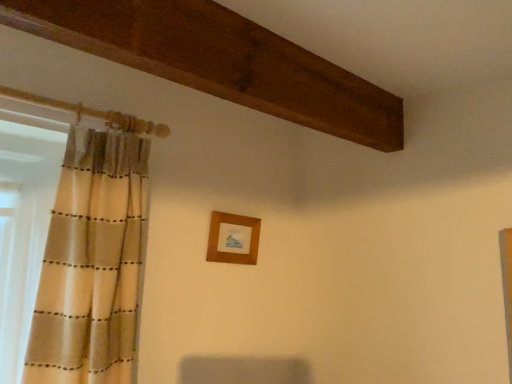
The width and height of the screenshot is (512, 384). What do you see at coordinates (233, 239) in the screenshot?
I see `wooden picture frame at center` at bounding box center [233, 239].

This screenshot has height=384, width=512. In order to click on wooden picture frame at center in this screenshot , I will do `click(233, 239)`.

What is the approximate height of wooden picture frame at center?

It is 22.09 centimeters.

You are a GUI agent. You are given a task and a screenshot of the screen. Output one action in this format:
    pyautogui.click(x=<x>, y=<y>)
    Task: Click on the wooden picture frame at center
    
    Given the screenshot: What is the action you would take?
    pyautogui.click(x=233, y=239)